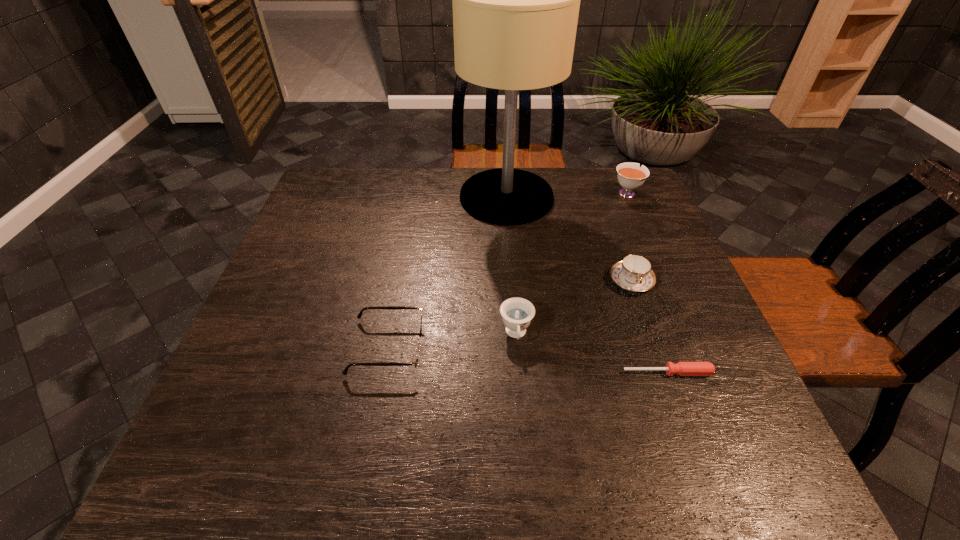
Where is `vacant region at the far edge of the desktop`? vacant region at the far edge of the desktop is located at coordinates (405, 185).

This screenshot has width=960, height=540. In the image, there is a desktop. Identify the location of vacant space at the near edge. (430, 453).

Identify the location of free spot at the left edge of the desktop. (306, 340).

Identify the location of vacant area at the right edge. This screenshot has height=540, width=960. (684, 300).

This screenshot has width=960, height=540. Identify the location of free space at the far left corner. (371, 171).

The image size is (960, 540). I want to click on free space at the near left corner of the desktop, so click(x=263, y=449).

In the image, there is a desktop. Find the location of `vacant area at the far right corner`. vacant area at the far right corner is located at coordinates (622, 187).

The width and height of the screenshot is (960, 540). What are the coordinates of `free space between the second tallest teacup and the second farthest teacup` in the screenshot? It's located at 574,308.

The image size is (960, 540). Identify the location of free point between the third tallest object and the shortest object. [x=592, y=353].

At what (x,y) coordinates should I click in order to perform the action: click on free space between the second tallest teacup and the third farthest object. Please return your answer as a coordinate pair (x, y). The height and width of the screenshot is (540, 960). Looking at the image, I should click on (574, 308).